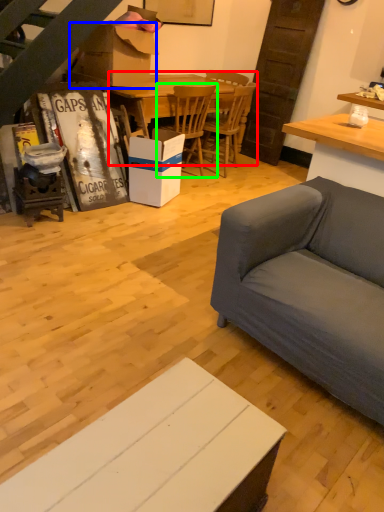
Question: Which object is positioned closest to kitchen & dining room table (highlighted by a red box)? Select from cardboard box (highlighted by a blue box) and chair (highlighted by a green box).

Choices:
 (A) cardboard box
 (B) chair

Answer: (B)